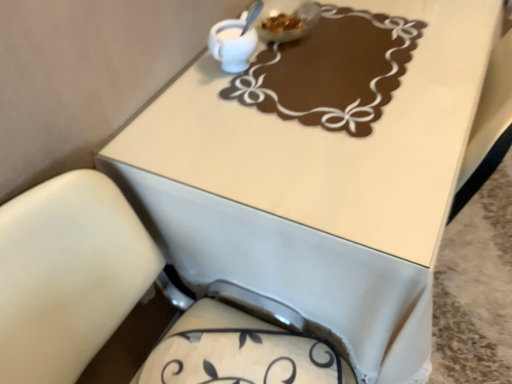
Find the location of a particular element. Image resolution: width=512 pixels, height=384 pixels. white fabric swivel chair at lower left is located at coordinates (67, 275).

Describe the element at coordinates (67, 275) in the screenshot. Image resolution: width=512 pixels, height=384 pixels. I see `white fabric swivel chair at lower left` at that location.

In order to face white fabric swivel chair at lower left, should I rotate leftwards or rightwards?

Rotate left and turn 6.931 degrees.

Identify the location of white fabric swivel chair at lower left. (67, 275).